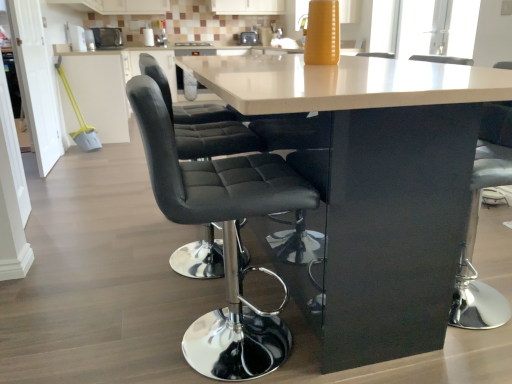
Where is `free spot to the left of black leather chair at center`? The image size is (512, 384). free spot to the left of black leather chair at center is located at coordinates (115, 329).